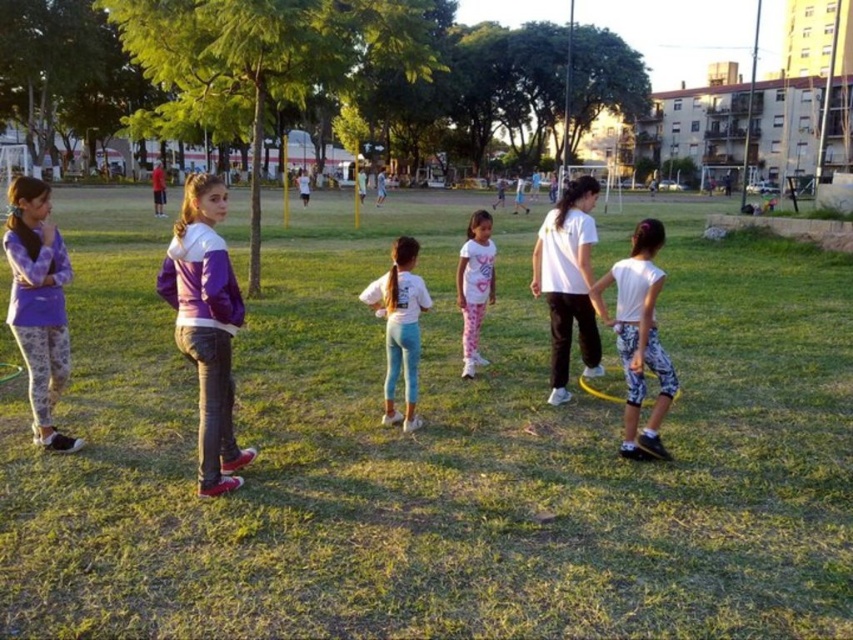
Who is higher up, purple matte jacket at center or white matte leggings at center?

purple matte jacket at center is above.

Is purple matte jacket at center in front of white matte leggings at center?

Yes, purple matte jacket at center is in front of white matte leggings at center.

Identify the location of purple matte jacket at center. (206, 324).

You are a GUI agent. You are given a task and a screenshot of the screen. Output one action in this format:
    pyautogui.click(x=<x>, y=<y>)
    Task: Click on the purple matte jacket at center
    The width and height of the screenshot is (853, 640).
    Given the screenshot: What is the action you would take?
    pyautogui.click(x=206, y=324)

Is purple fleece jacket at left smaller than white printed leggings at center?

Correct, purple fleece jacket at left occupies less space than white printed leggings at center.

What do you see at coordinates (38, 304) in the screenshot?
I see `purple fleece jacket at left` at bounding box center [38, 304].

In order to click on purple fleece jacket at left in this screenshot , I will do (x=38, y=304).

Where is `purple fleece jacket at left`? purple fleece jacket at left is located at coordinates (38, 304).

From the picture: Does purple fleece jacket at left have a lesser width compared to white matte leggings at center?

No.

Between point (38, 225) and point (387, 301), which one is positioned in front?

Positioned in front is point (38, 225).

Where is `purple fleece jacket at left`? This screenshot has width=853, height=640. purple fleece jacket at left is located at coordinates (38, 304).